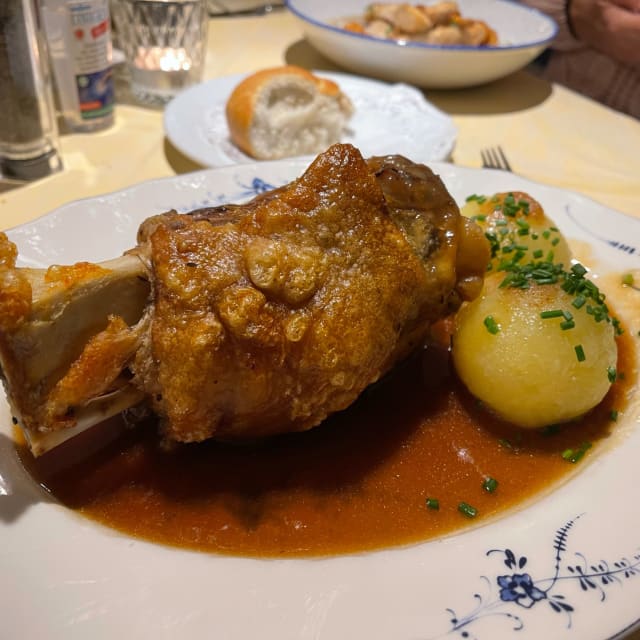
This screenshot has height=640, width=640. Find the location of `fork`. fork is located at coordinates (491, 154), (499, 163).